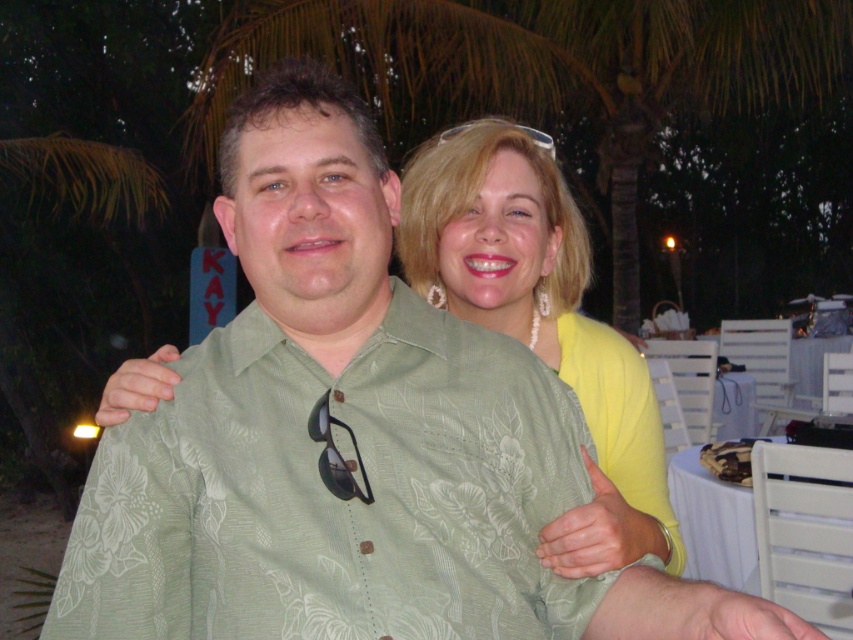
Who is taller, green floral-patterned shirt at center or green leafy palm tree at upper center?

Standing taller between the two is green leafy palm tree at upper center.

Which is in front, point (201, 525) or point (445, 29)?

Point (201, 525)

Which is in front, point (257, 314) or point (439, 28)?

Point (257, 314)

This screenshot has height=640, width=853. Identify the location of green floral-patterned shirt at center. (335, 493).

Which is in front, point (517, 60) or point (413, 202)?

Point (413, 202) is more forward.

Consider the image. Is green leafy palm tree at upper center behind pearl necklace at upper center?

That is True.

In order to click on green leafy palm tree at upper center in this screenshot , I will do pos(543,70).

Can you confirm if green floral-patterned shirt at center is wider than pearl necklace at upper center?

Yes, green floral-patterned shirt at center is wider than pearl necklace at upper center.

Based on the photo, between green floral-patterned shirt at center and pearl necklace at upper center, which one appears on the left side from the viewer's perspective?

From the viewer's perspective, green floral-patterned shirt at center appears more on the left side.

Does point (248, 483) come farther from viewer compared to point (585, 342)?

That is False.

At what (x,y) coordinates should I click in order to perform the action: click on green floral-patterned shirt at center. Please return your answer as a coordinate pair (x, y). The image size is (853, 640). Looking at the image, I should click on (335, 493).